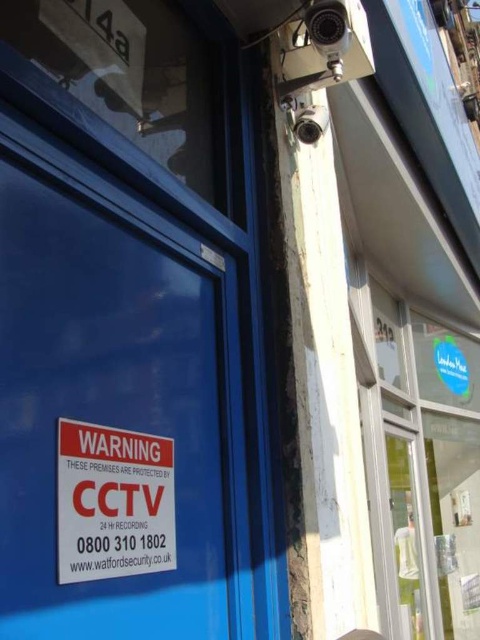
Question: Is blue matte sign at center bigger than white paper sign at center?

Choices:
 (A) no
 (B) yes

Answer: (B)

Question: Is blue matte sign at center smaller than white paper sign at center?

Choices:
 (A) yes
 (B) no

Answer: (B)

Question: Which object is farther from the camera taking this photo?

Choices:
 (A) blue matte sign at center
 (B) white paper sign at center

Answer: (B)

Question: Where is blue matte sign at center located in relation to white paper sign at center in the image?

Choices:
 (A) above
 (B) below

Answer: (A)

Question: Among these points, which one is farthest from the camera?

Choices:
 (A) (164, 493)
 (B) (152, 336)

Answer: (B)